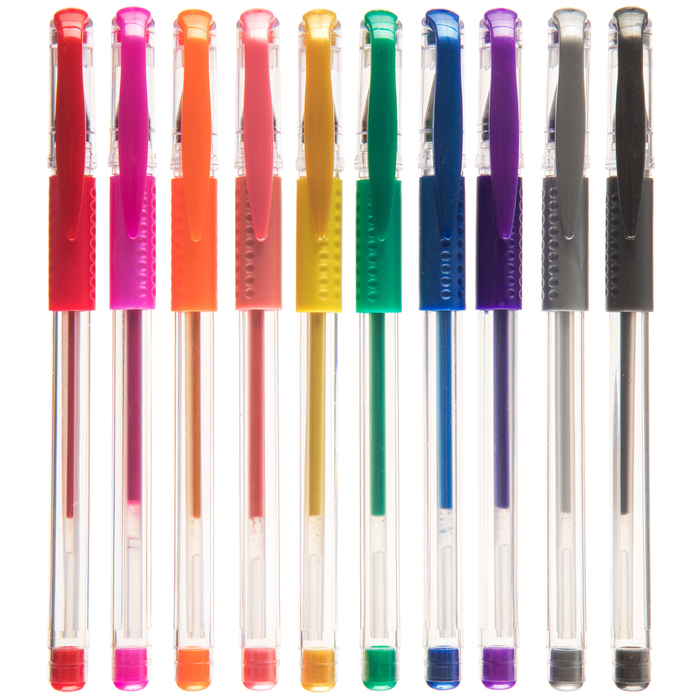
You are a GUI agent. You are given a task and a screenshot of the screen. Output one action in this format:
    pyautogui.click(x=<x>, y=<y>)
    Task: Click on the pens
    
    Given the screenshot: What is the action you would take?
    pyautogui.click(x=69, y=654), pyautogui.click(x=132, y=662), pyautogui.click(x=192, y=672), pyautogui.click(x=260, y=679), pyautogui.click(x=325, y=671), pyautogui.click(x=381, y=671), pyautogui.click(x=458, y=672), pyautogui.click(x=490, y=668), pyautogui.click(x=579, y=658), pyautogui.click(x=614, y=665)